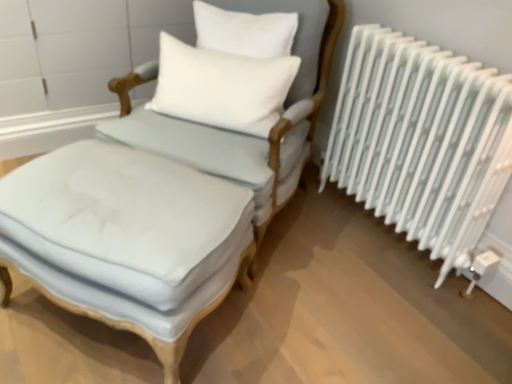
You are a GUI agent. You are given a task and a screenshot of the screen. Output one action in this format:
    pyautogui.click(x=<x>, y=<y>)
    Task: Click on the free space that is to the left of white metal radiator at right
    
    Given the screenshot: What is the action you would take?
    pyautogui.click(x=318, y=240)